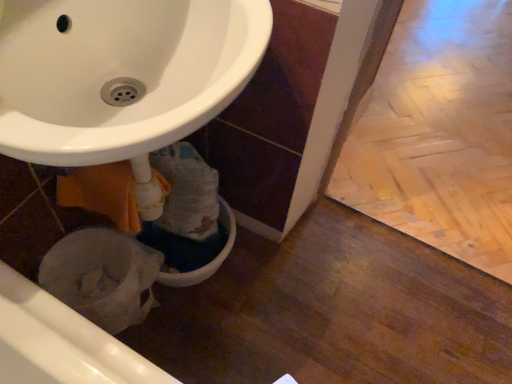
Question: Do you think white plastic bidet at lower left is within wooden parquet floor at lower right, or outside of it?

Choices:
 (A) inside
 (B) outside

Answer: (B)

Question: Considering the relative positions of white plastic bidet at lower left and wooden parquet floor at lower right in the image provided, is white plastic bidet at lower left to the left or to the right of wooden parquet floor at lower right?

Choices:
 (A) right
 (B) left

Answer: (B)

Question: From the image's perspective, is white plastic bidet at lower left positioned above or below wooden parquet floor at lower right?

Choices:
 (A) below
 (B) above

Answer: (A)

Question: Do you think wooden parquet floor at lower right is within white plastic bidet at lower left, or outside of it?

Choices:
 (A) inside
 (B) outside

Answer: (B)

Question: Is point (424, 183) closer or farther from the camera than point (75, 284)?

Choices:
 (A) farther
 (B) closer

Answer: (A)

Question: In terms of height, does wooden parquet floor at lower right look taller or shorter compared to white plastic bidet at lower left?

Choices:
 (A) tall
 (B) short

Answer: (B)

Question: In the image, is wooden parquet floor at lower right positioned in front of or behind white plastic bidet at lower left?

Choices:
 (A) front
 (B) behind

Answer: (B)